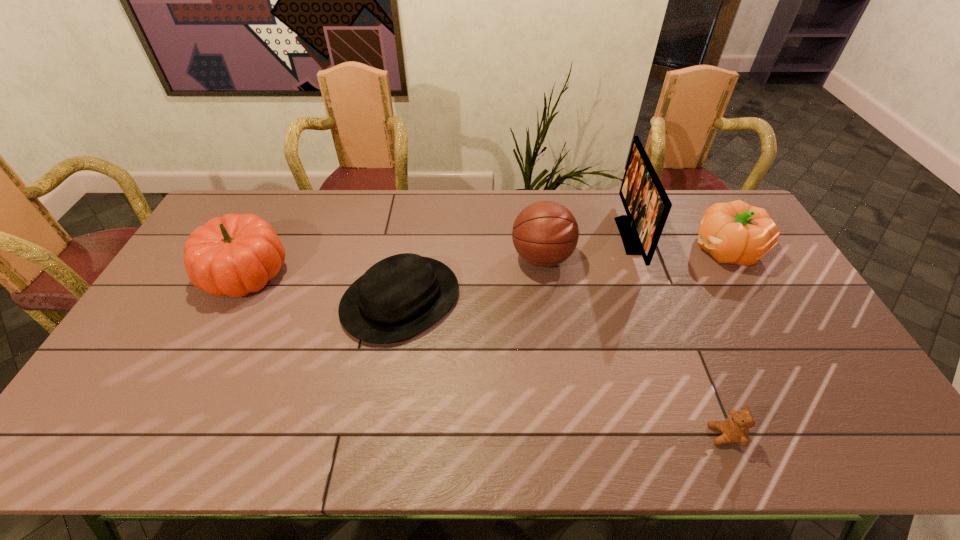
Locate an element on the screen. free space that satisfies the following two spatial constraints: 1. on the front-facing side of the monitor; 2. on the front side of the left pumpkin is located at coordinates point(643,273).